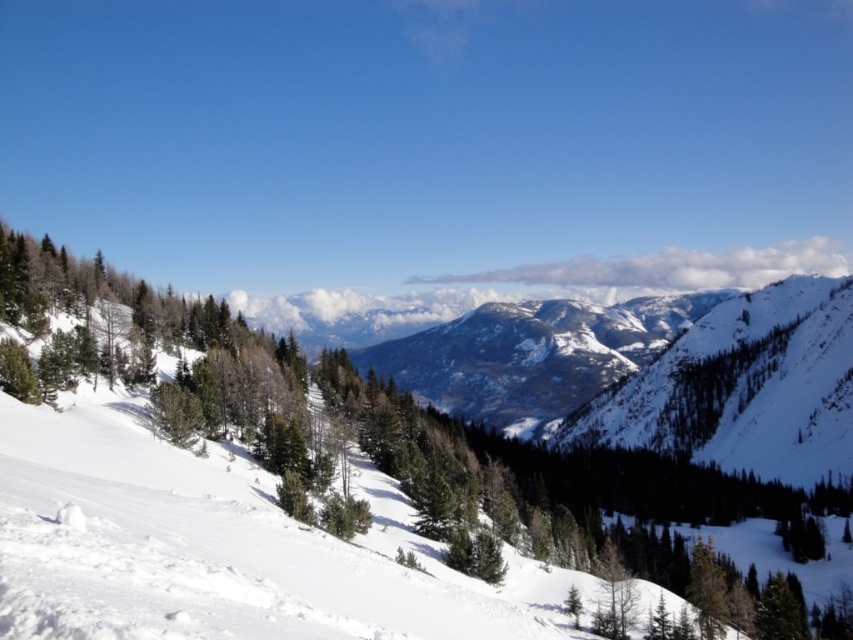
Can you confirm if green matte tree at center is smaller than snowy rocky mountain at center?

Yes, green matte tree at center is smaller than snowy rocky mountain at center.

Is green matte tree at center below snowy rocky mountain at center?

Indeed, green matte tree at center is positioned under snowy rocky mountain at center.

At what (x,y) coordinates should I click in order to perform the action: click on green matte tree at center. Please return your answer as a coordinate pair (x, y). This screenshot has height=640, width=853. Looking at the image, I should click on (347, 436).